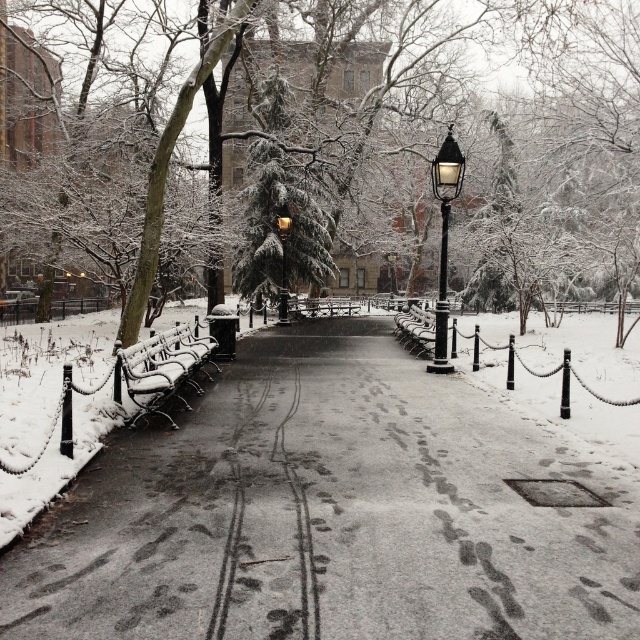
Consider the image. You are standing at the camera position in the winter scene. There is a point marked at coordinates point (248, 630). Can you reach that point without moving your position? Explain why or why not.

The point (248, 630) is 13.30 feet away from the camera. Since you are standing at the camera position, you cannot physically reach a point that is 13.30 feet away without moving from your current position.